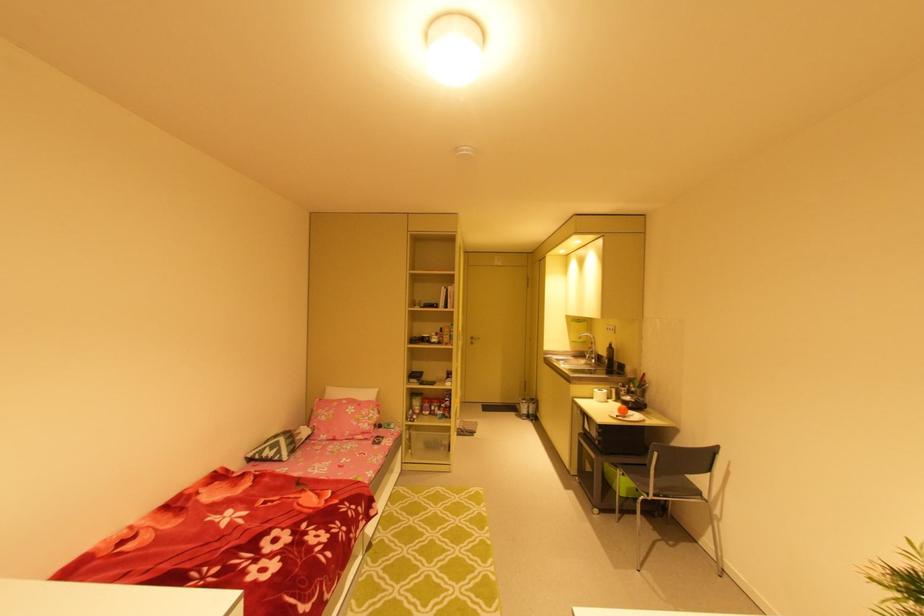
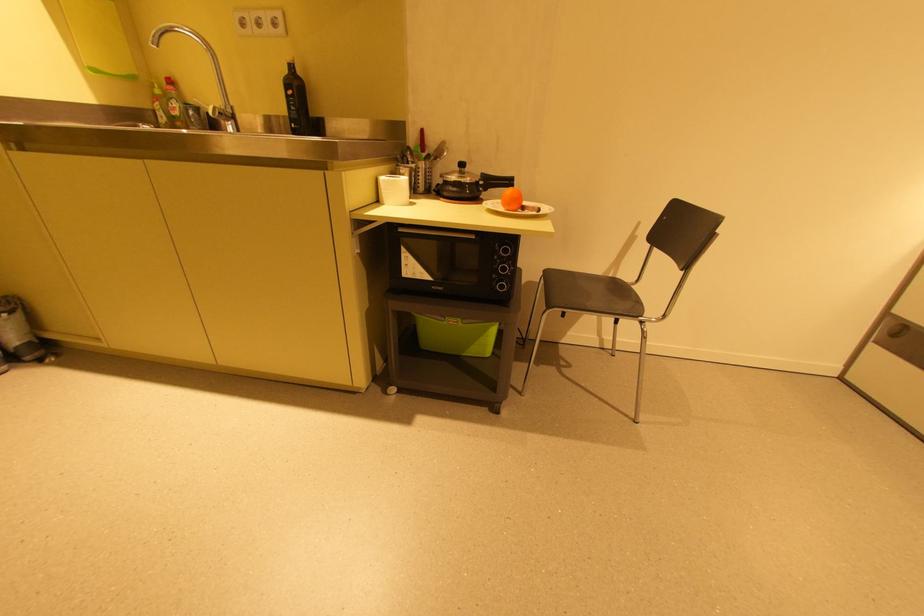
Find the pixel in the second image that matches point (617, 329) in the first image.

(284, 15)